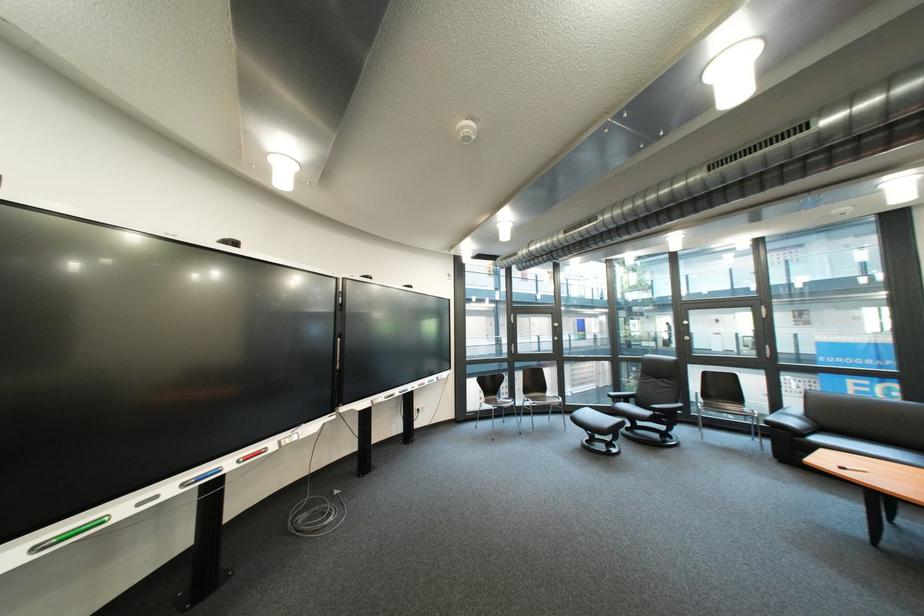
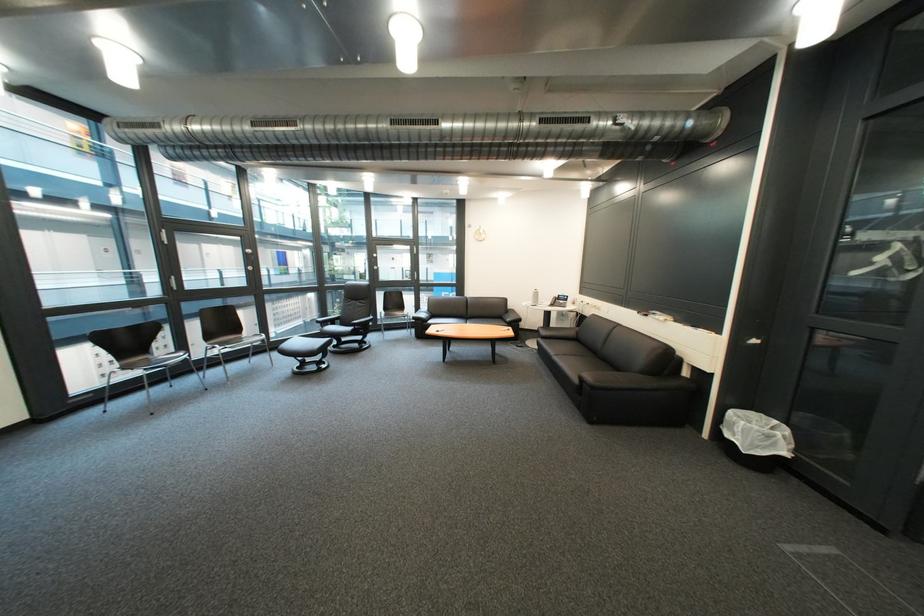
Question: I am providing you with two images of the same scene from different viewpoints. Which of the following objects are not visible in image2?

Choices:
 (A) black sofa armrest
 (B) lounge chair sitting surface
 (C) telephone handset
 (D) none of these

Answer: (D)